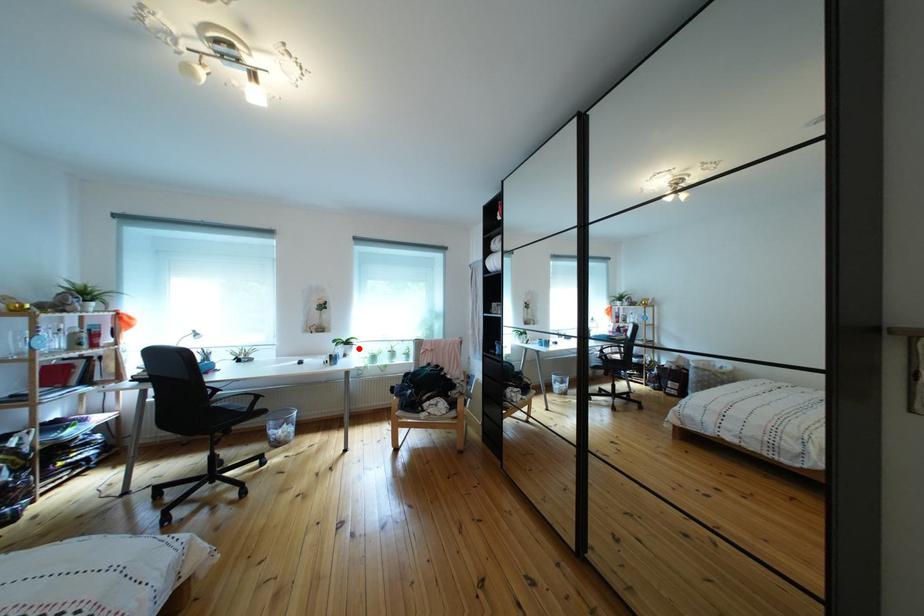
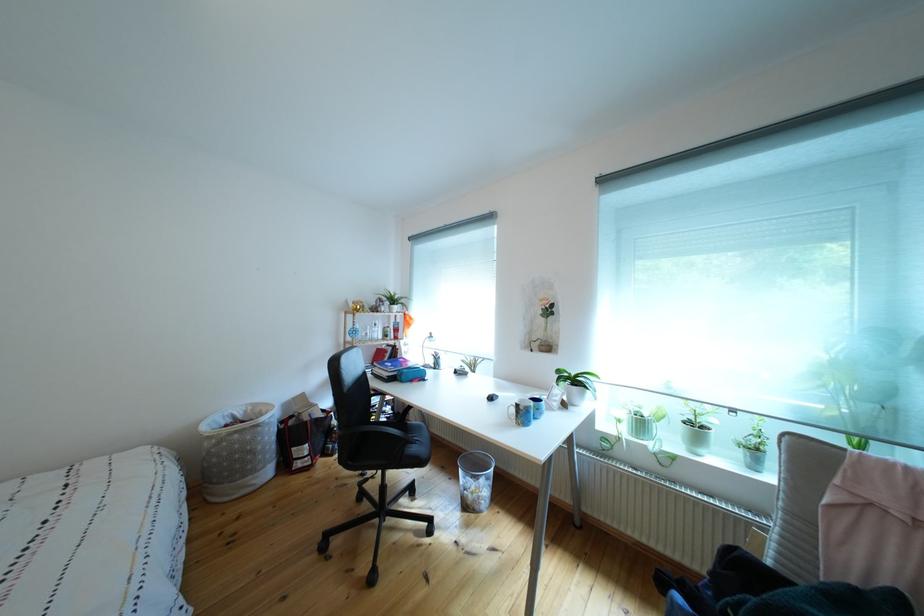
Find the pixel in the second image that matches the highlighted location in the first image.

(588, 387)